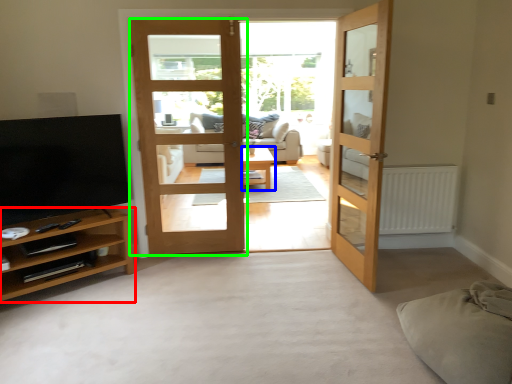
Question: Based on their relative distances, which object is nearer to cabinetry (highlighted by a red box)? Choose from table (highlighted by a blue box) and door (highlighted by a green box).

Choices:
 (A) table
 (B) door

Answer: (B)